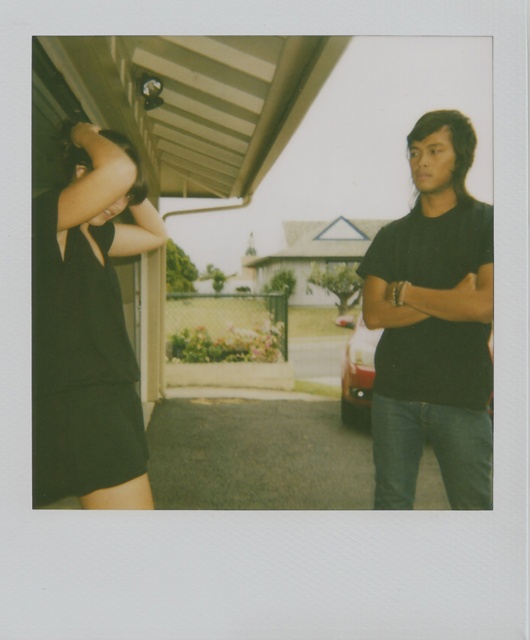
Can you confirm if black matte t-shirt at right is positioned below black matte dress at left?

Actually, black matte t-shirt at right is above black matte dress at left.

Between black matte t-shirt at right and black matte dress at left, which one appears on the left side from the viewer's perspective?

Positioned to the left is black matte dress at left.

Which is in front, point (439, 189) or point (98, 198)?

Positioned in front is point (98, 198).

Where is `black matte t-shirt at right`? The image size is (530, 640). black matte t-shirt at right is located at coordinates (432, 324).

Between black matte t-shirt at right and metallic silver car at center, which one appears on the left side from the viewer's perspective?

black matte t-shirt at right

Which is above, black matte t-shirt at right or metallic silver car at center?

black matte t-shirt at right is higher up.

The width and height of the screenshot is (530, 640). What do you see at coordinates (432, 324) in the screenshot?
I see `black matte t-shirt at right` at bounding box center [432, 324].

Where is `black matte t-shirt at right`? The width and height of the screenshot is (530, 640). black matte t-shirt at right is located at coordinates (432, 324).

Which is in front, point (127, 170) or point (348, 342)?

Point (127, 170) is in front.

Is black matte dress at left closer to the viewer compared to metallic silver car at center?

Yes.

Image resolution: width=530 pixels, height=640 pixels. Describe the element at coordinates (89, 326) in the screenshot. I see `black matte dress at left` at that location.

Locate an element on the screen. black matte dress at left is located at coordinates (89, 326).